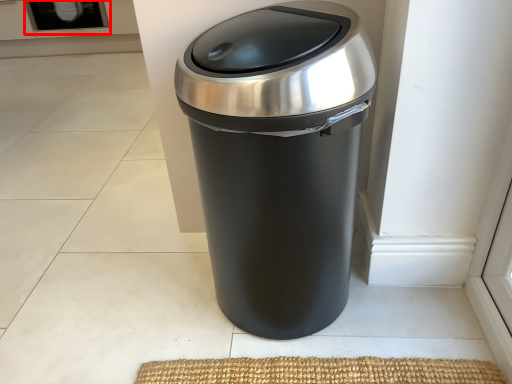
Question: From the image's perspective, what is the correct spatial relationship of screen door (annotated by the red box) in relation to waste container?

Choices:
 (A) below
 (B) above

Answer: (B)